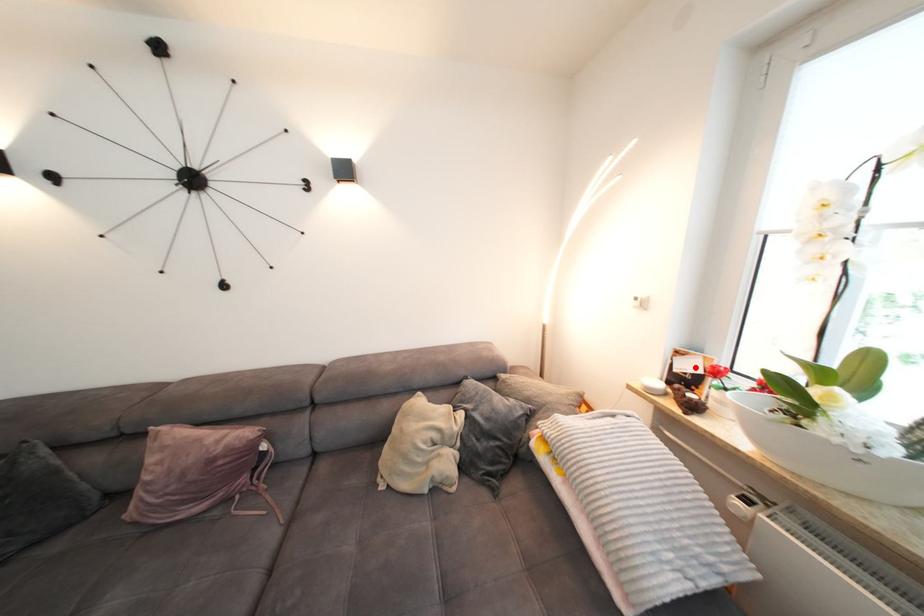
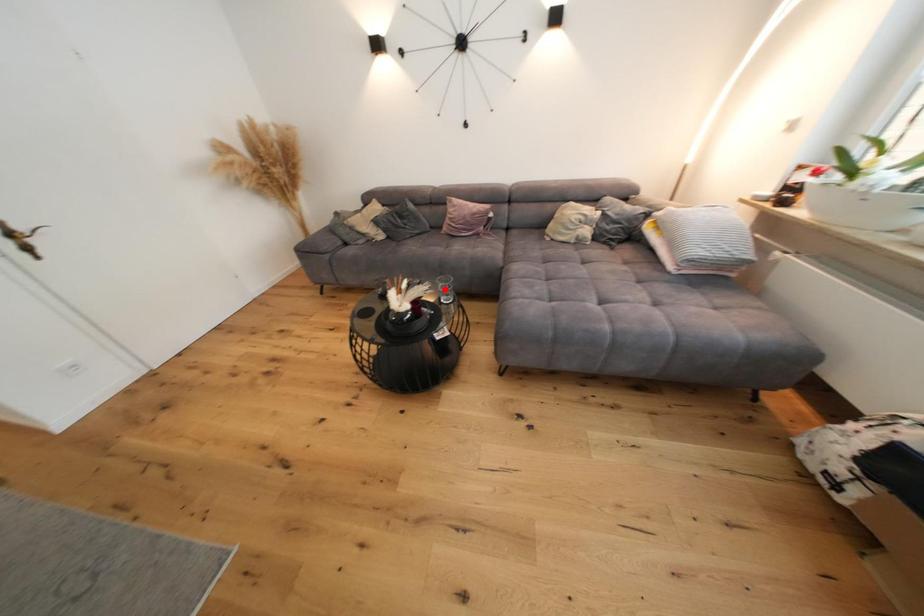
I am providing you with two images of the same scene from different viewpoints. A red point is marked on the first image and another point is marked on the second image. Are the points marked in image1 and image2 representing the same 3D position?

No